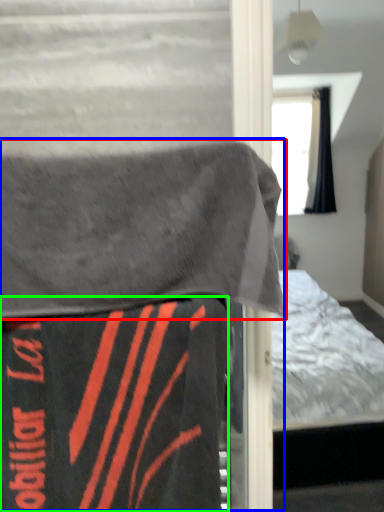
Question: Which is nearer to the blanket (highlighted by a red box)? bed (highlighted by a blue box) or blanket (highlighted by a green box).

Choices:
 (A) bed
 (B) blanket

Answer: (A)